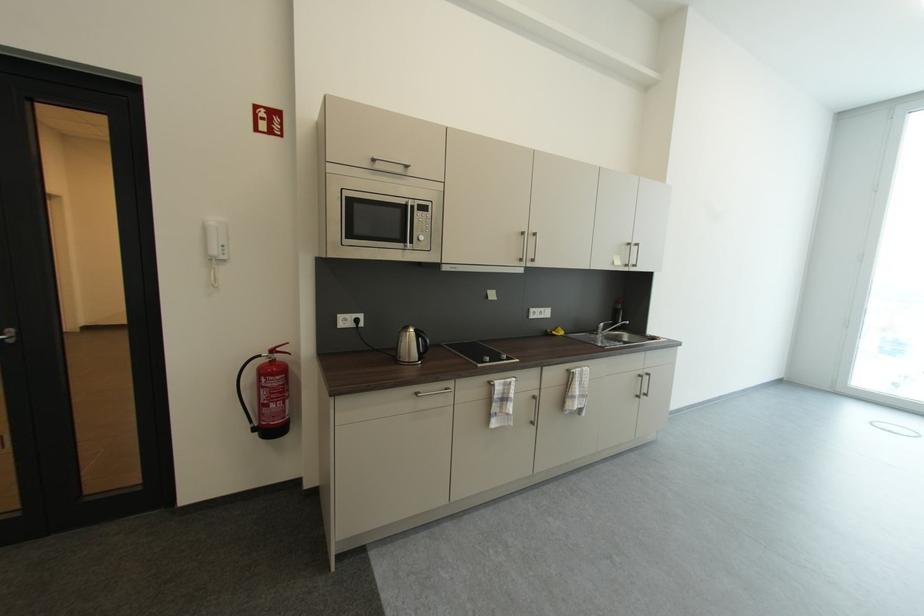
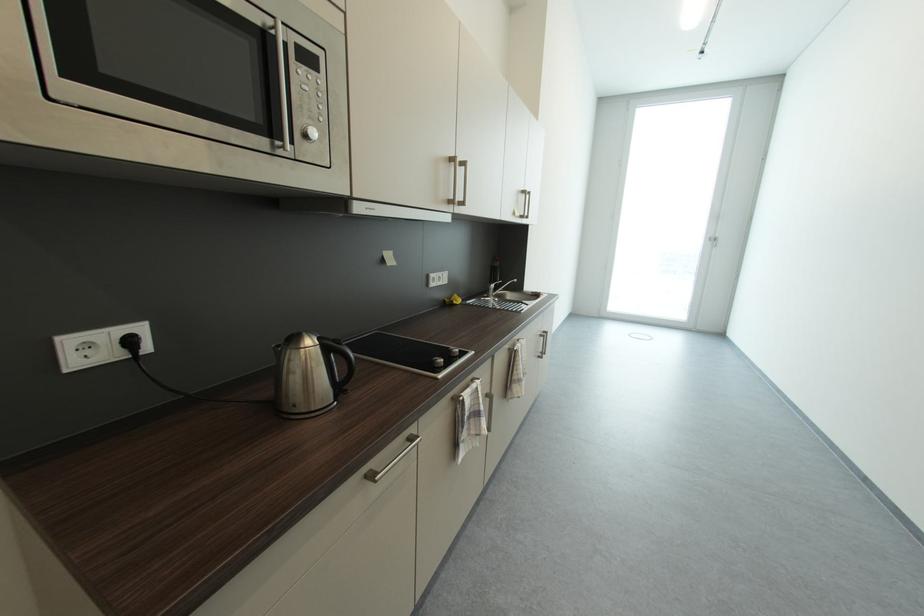
Question: The camera is either moving clockwise (left) or counter-clockwise (right) around the object. The first image is from the beginning of the video and the second image is from the end. Is the camera moving left or right when shooting the video?

Choices:
 (A) Left
 (B) Right

Answer: (A)